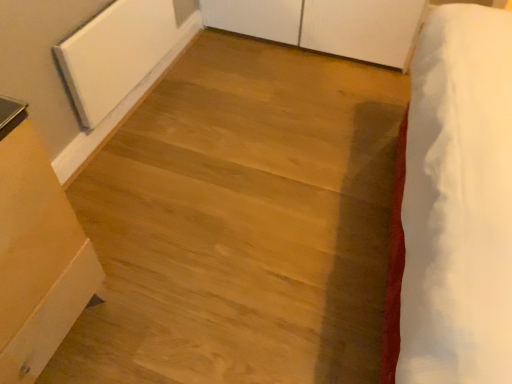
Find the location of a particular element. free space to the back side of light wood table at left is located at coordinates (112, 212).